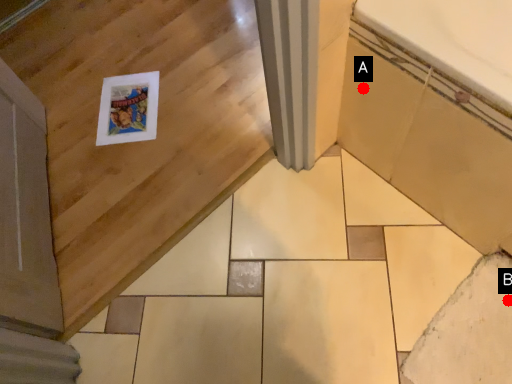
Question: Two points are circled on the image, labeled by A and B beside each circle. Which of the following is the farthest from the observer?

Choices:
 (A) A is further
 (B) B is further

Answer: (B)